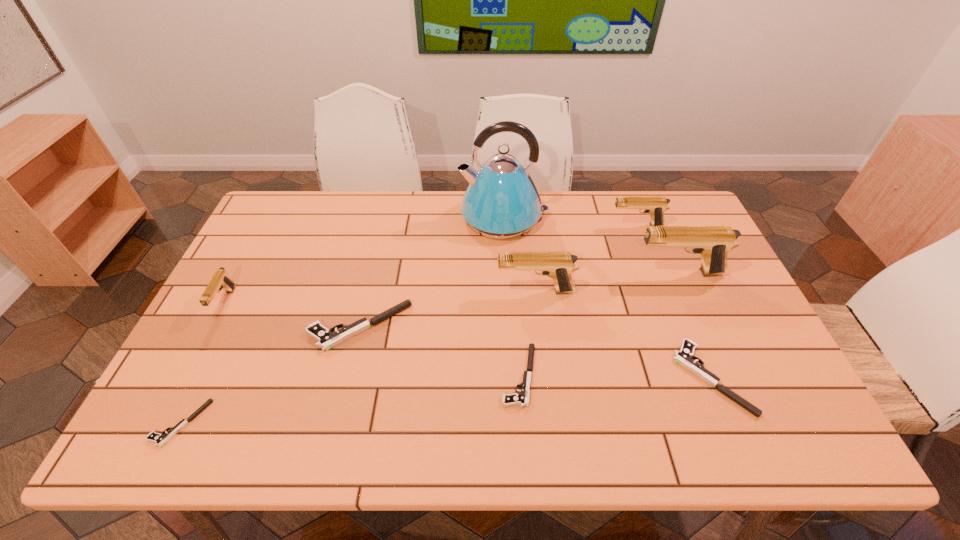
Locate an element on the screen. The height and width of the screenshot is (540, 960). vacant point that satisfies the following two spatial constraints: 1. at the spout of the tallest object; 2. at the barrel of the fifth shortest object is located at coordinates (509, 302).